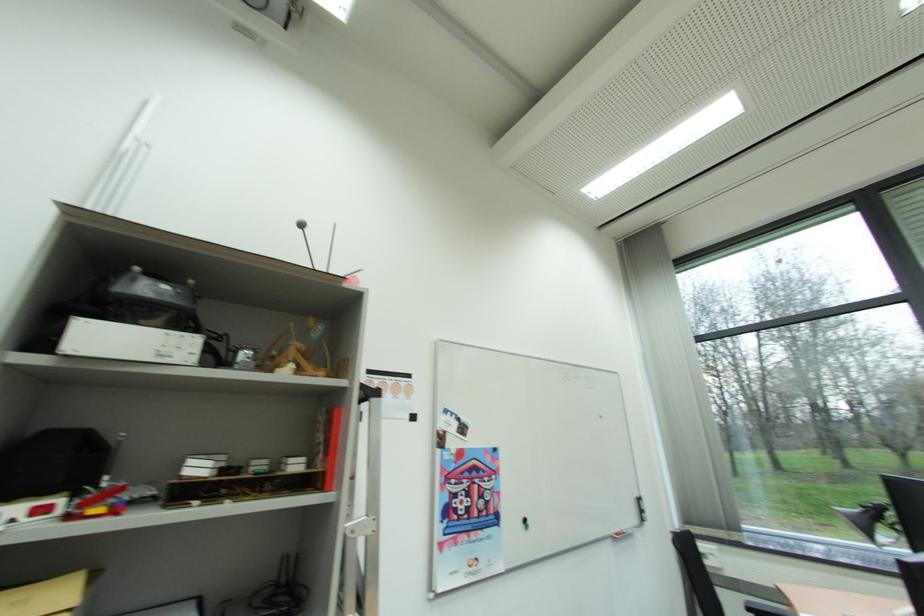
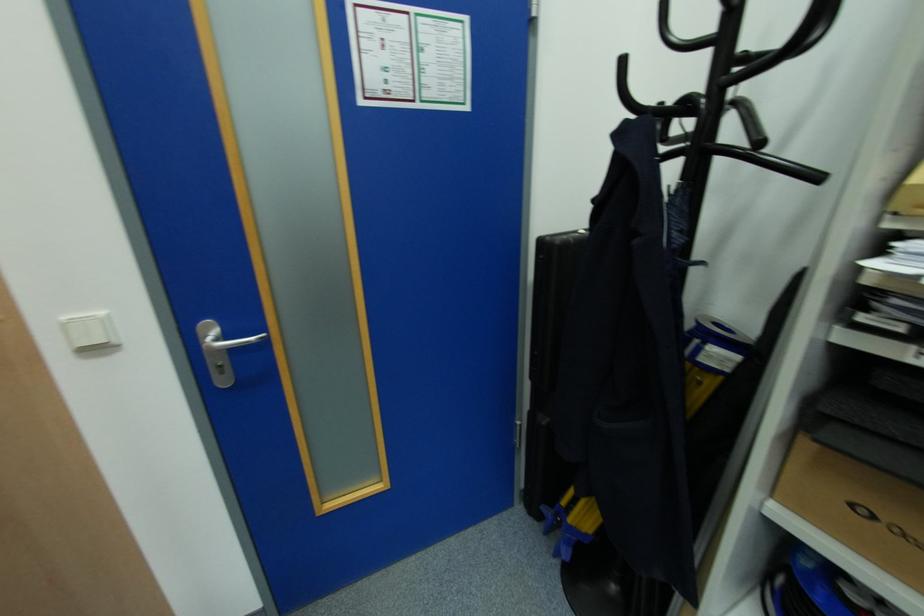
Question: The camera is either moving clockwise (left) or counter-clockwise (right) around the object. The first image is from the beginning of the video and the second image is from the end. Is the camera moving left or right when shooting the video?

Choices:
 (A) Left
 (B) Right

Answer: (B)